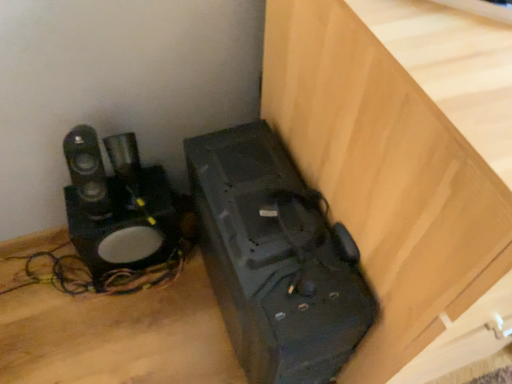
Question: Is black plastic speaker at lower left completely or partially inside matte black speaker at lower right?

Choices:
 (A) yes
 (B) no

Answer: (B)

Question: Could you tell me if matte black speaker at lower right is facing black plastic speaker at lower left?

Choices:
 (A) no
 (B) yes

Answer: (A)

Question: Is matte black speaker at lower right not near black plastic speaker at lower left?

Choices:
 (A) no
 (B) yes

Answer: (A)

Question: Can you confirm if matte black speaker at lower right is positioned to the left of black plastic speaker at lower left?

Choices:
 (A) yes
 (B) no

Answer: (A)

Question: Considering the relative sizes of matte black speaker at lower right and black plastic speaker at lower left in the image provided, is matte black speaker at lower right smaller than black plastic speaker at lower left?

Choices:
 (A) yes
 (B) no

Answer: (A)

Question: Is matte black speaker at lower right positioned in front of black plastic speaker at lower left?

Choices:
 (A) no
 (B) yes

Answer: (A)

Question: Does black plastic speaker at lower left have a greater height compared to matte black speaker at lower right?

Choices:
 (A) yes
 (B) no

Answer: (A)

Question: From the image's perspective, is black plastic speaker at lower left over matte black speaker at lower right?

Choices:
 (A) yes
 (B) no

Answer: (A)

Question: Is black plastic speaker at lower left further to the viewer compared to matte black speaker at lower right?

Choices:
 (A) no
 (B) yes

Answer: (A)

Question: Is black plastic speaker at lower left positioned beyond the bounds of matte black speaker at lower right?

Choices:
 (A) no
 (B) yes

Answer: (B)

Question: Can you confirm if black plastic speaker at lower left is wider than matte black speaker at lower right?

Choices:
 (A) no
 (B) yes

Answer: (B)

Question: Considering the relative sizes of black plastic speaker at lower left and matte black speaker at lower right in the image provided, is black plastic speaker at lower left shorter than matte black speaker at lower right?

Choices:
 (A) yes
 (B) no

Answer: (B)

Question: Is point (333, 211) positioned closer to the camera than point (267, 297)?

Choices:
 (A) farther
 (B) closer

Answer: (A)